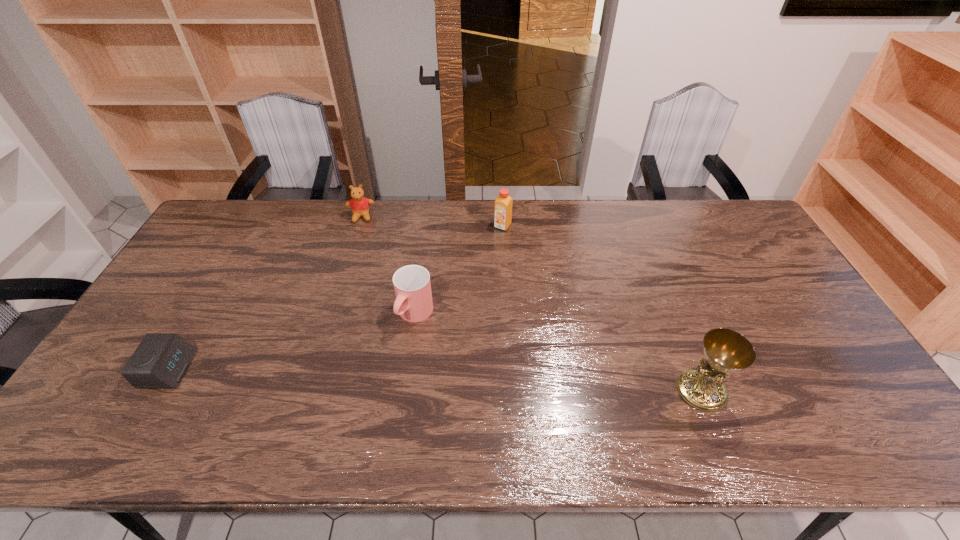
In order to click on free space on the desktop that is between the alarm clock and the rightmost object and is positioned on the side of the third object from right to left with the handle in this screenshot , I will do `click(373, 377)`.

Image resolution: width=960 pixels, height=540 pixels. In order to click on free spot on the desktop that is between the shortest object and the tallest object and is positioned on the front-facing side of the fourth object from right to left in this screenshot , I will do `click(353, 377)`.

At what (x,y) coordinates should I click in order to perform the action: click on free spot on the desktop that is between the shortest object and the tallest object and is positioned on the front and back of the orange juice. Please return your answer as a coordinate pair (x, y). This screenshot has width=960, height=540. Looking at the image, I should click on (400, 379).